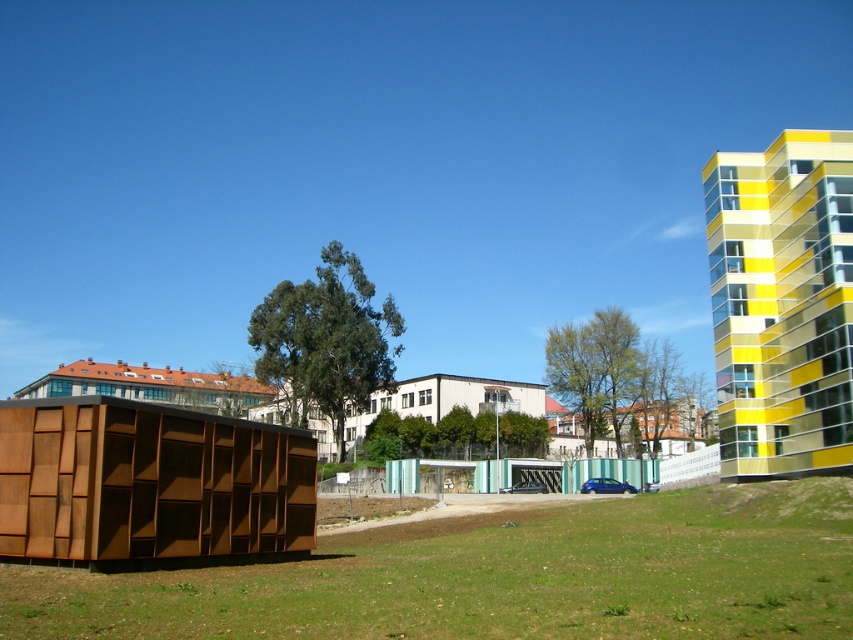
Question: Among these objects, which one is nearest to the camera?

Choices:
 (A) green grass at lower center
 (B) corten steel hut at left
 (C) brown wooden hut at upper left
 (D) yellow glass building at right

Answer: (A)

Question: In this image, where is green grass at lower center located relative to yellow glass building at right?

Choices:
 (A) above
 (B) below

Answer: (B)

Question: Does yellow glass building at right appear on the left side of brown wooden hut at upper left?

Choices:
 (A) yes
 (B) no

Answer: (B)

Question: Estimate the real-world distances between objects in this image. Which object is farther from the brown wooden hut at upper left?

Choices:
 (A) yellow glass building at right
 (B) green grass at lower center
 (C) corten steel hut at left

Answer: (C)

Question: Does green grass at lower center appear under yellow glass building at right?

Choices:
 (A) no
 (B) yes

Answer: (B)

Question: Which point is farther from the camera taking this photo?

Choices:
 (A) click(x=76, y=390)
 (B) click(x=190, y=416)

Answer: (A)